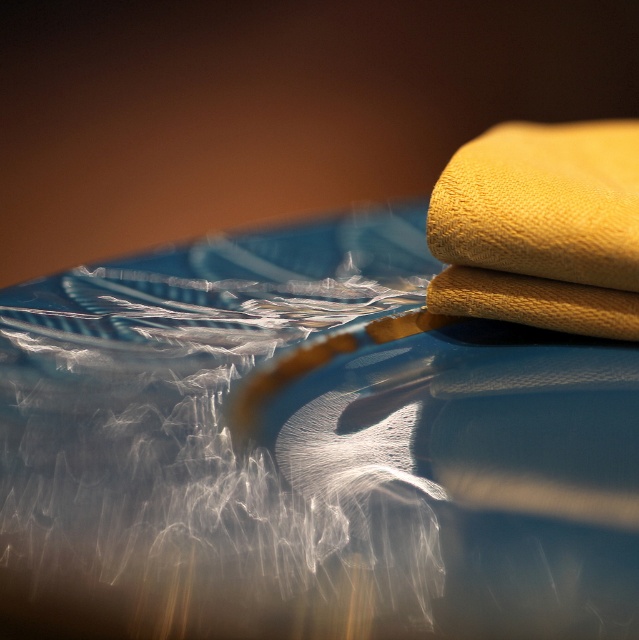
Between point (112, 480) and point (633, 275), which one is positioned behind?

The point (633, 275) is more distant.

Which of these two, translucent plastic bag at center or yellow fabric at upper right, stands taller?

translucent plastic bag at center is taller.

Does point (339, 394) come closer to viewer compared to point (553, 179)?

Yes.

Locate an element on the screen. This screenshot has height=640, width=639. translucent plastic bag at center is located at coordinates (309, 449).